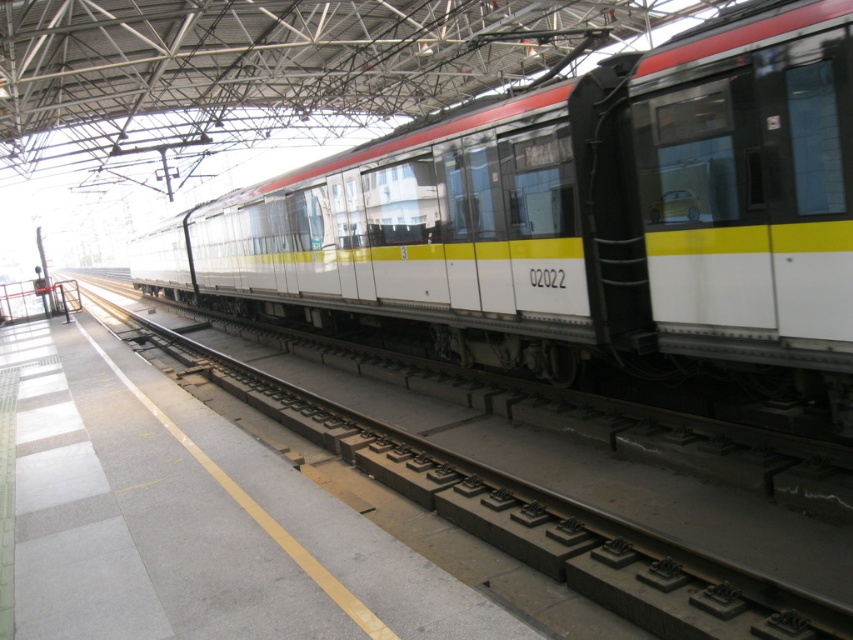
Question: Which object appears closest to the camera in this image?

Choices:
 (A) white glossy train at center
 (B) white glossy track at center

Answer: (B)

Question: Is white glossy train at center smaller than white glossy track at center?

Choices:
 (A) yes
 (B) no

Answer: (B)

Question: Which of the following is the closest to the observer?

Choices:
 (A) white glossy track at center
 (B) white glossy train at center

Answer: (A)

Question: Which of the following is the closest to the observer?

Choices:
 (A) white glossy track at center
 (B) white glossy train at center

Answer: (A)

Question: Is white glossy train at center to the right of white glossy track at center from the viewer's perspective?

Choices:
 (A) no
 (B) yes

Answer: (A)

Question: Can you confirm if white glossy train at center is smaller than white glossy track at center?

Choices:
 (A) yes
 (B) no

Answer: (B)